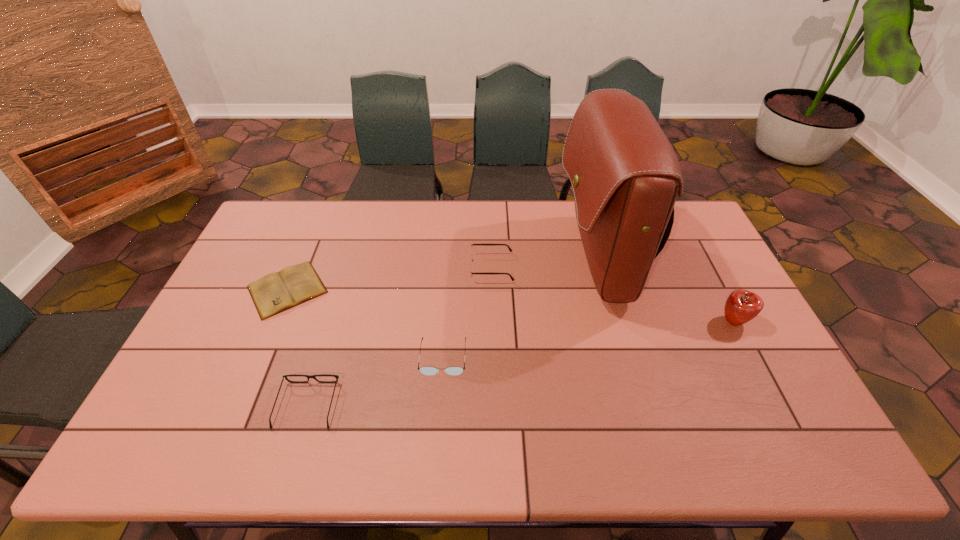
Image resolution: width=960 pixels, height=540 pixels. Find the location of `vacant region at the right edge of the desktop`. vacant region at the right edge of the desktop is located at coordinates (727, 276).

At what (x,y) coordinates should I click in order to perform the action: click on vacant area at the far left corner of the desktop. Please return your answer as a coordinate pair (x, y). The image size is (960, 540). Looking at the image, I should click on (281, 209).

At what (x,y) coordinates should I click in order to perform the action: click on vacant space at the far right corner. Please return your answer as a coordinate pair (x, y). The width and height of the screenshot is (960, 540). Looking at the image, I should click on (701, 230).

Where is `vacant area between the book and the rightmost object`? Image resolution: width=960 pixels, height=540 pixels. vacant area between the book and the rightmost object is located at coordinates (511, 306).

Locate an element on the screen. The width and height of the screenshot is (960, 540). vacant area that lies between the book and the farthest spectacles is located at coordinates (389, 279).

This screenshot has width=960, height=540. What are the coordinates of `blank region between the second spectacles from left to right and the book` in the screenshot? It's located at (x=366, y=323).

Locate an element on the screen. unoccupied area between the leftmost spectacles and the apple is located at coordinates (520, 363).

This screenshot has height=540, width=960. In order to click on vacant area between the rightmost object and the nearest spectacles in this screenshot , I will do `click(520, 363)`.

What are the coordinates of `vacant space in between the book and the second object from right to left` in the screenshot? It's located at (443, 274).

Where is `free spot between the fifth object from left to right and the second nearest object`? The height and width of the screenshot is (540, 960). free spot between the fifth object from left to right and the second nearest object is located at coordinates (520, 308).